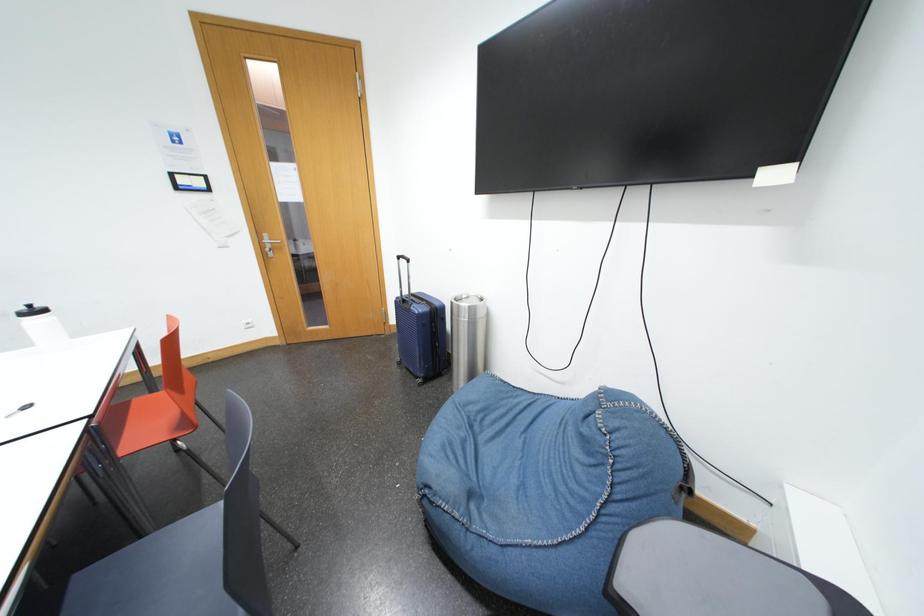
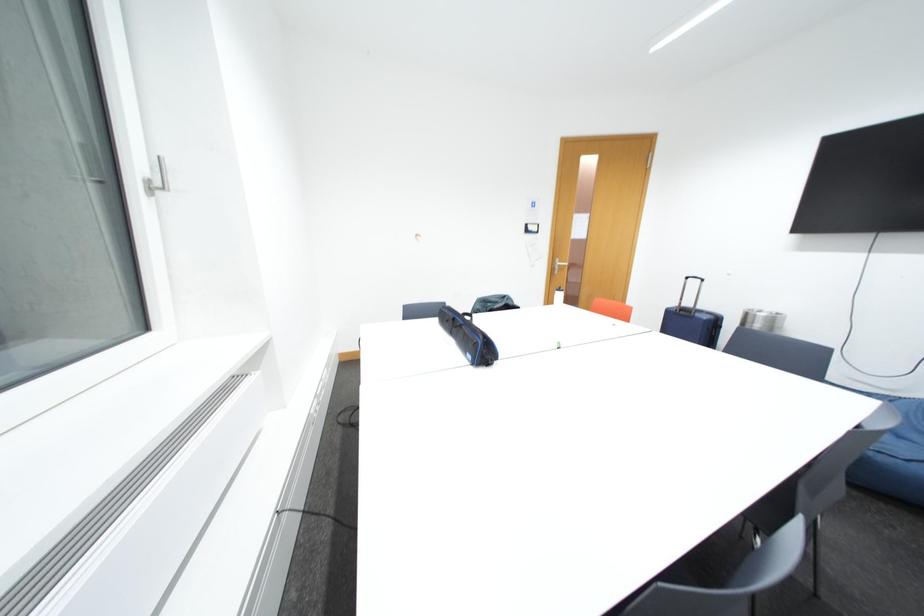
Consider the image. What movement of the cameraman would produce the second image?

The cameraman walked toward left, backward.